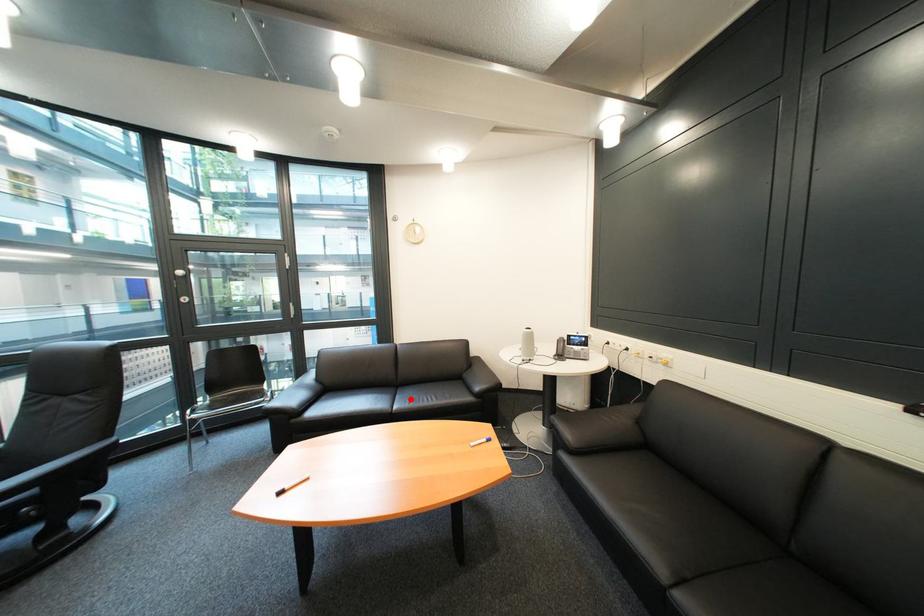
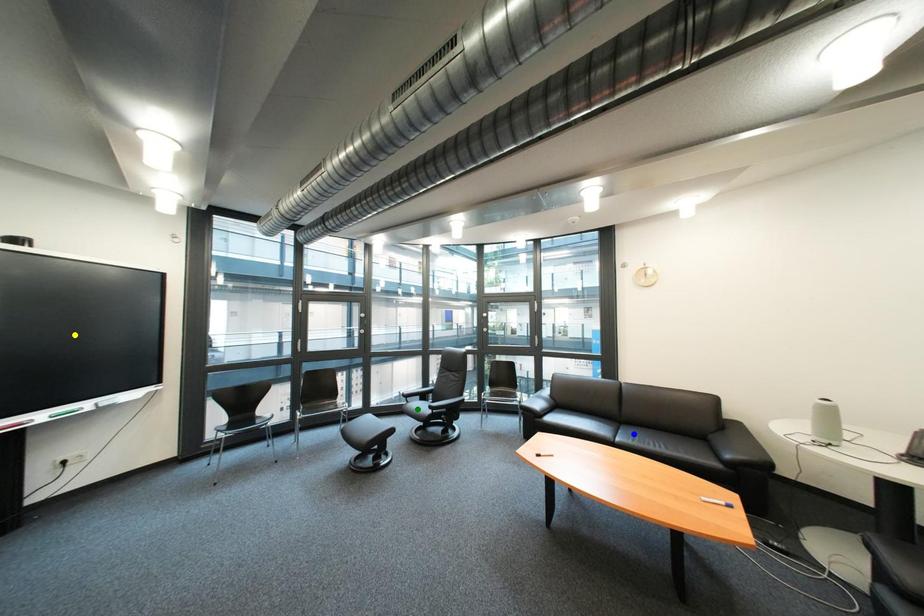
Question: I am providing you with two images of the same scene from different viewpoints. A red point is marked on the first image. You are given multiple points on the second image. In image 2, which mark is for the same physical point as the one in image 1?

Choices:
 (A) yellow point
 (B) blue point
 (C) green point

Answer: (B)